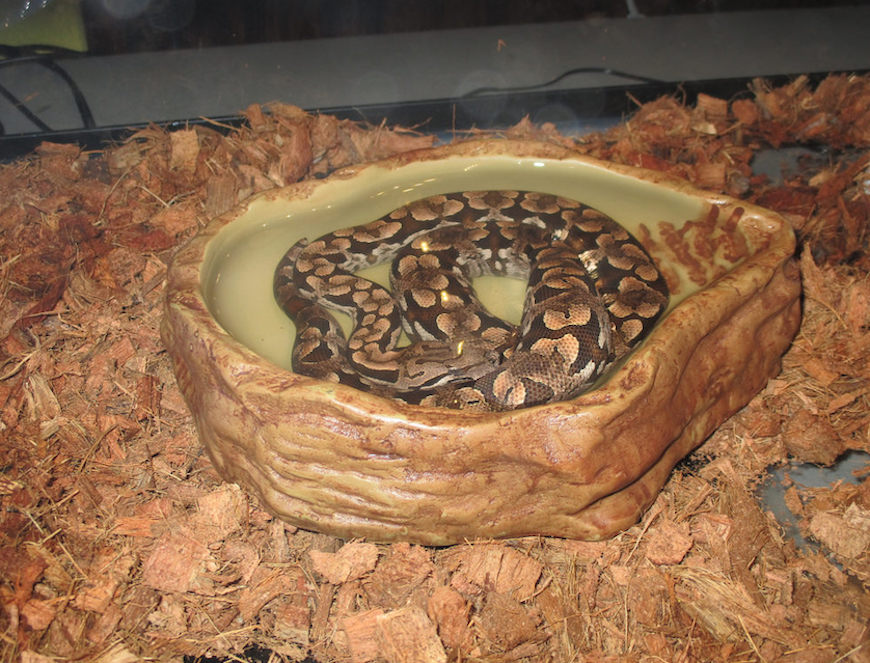
Locate an element on the screen. The image size is (870, 663). scales is located at coordinates (564, 351).